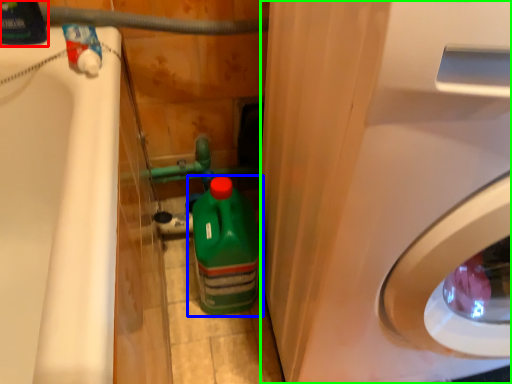
Question: Based on their relative distances, which object is farther from cleaning product (highlighted by a red box)? Choose from bottle (highlighted by a blue box) and washing machine (highlighted by a green box).

Choices:
 (A) bottle
 (B) washing machine

Answer: (B)